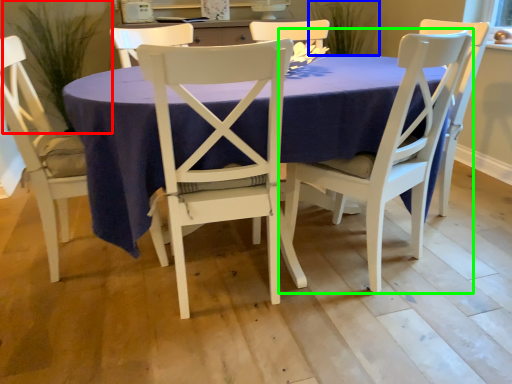
Question: Which is nearer to the plant (highlighted by a red box)? plant (highlighted by a blue box) or chair (highlighted by a green box).

Choices:
 (A) plant
 (B) chair

Answer: (A)